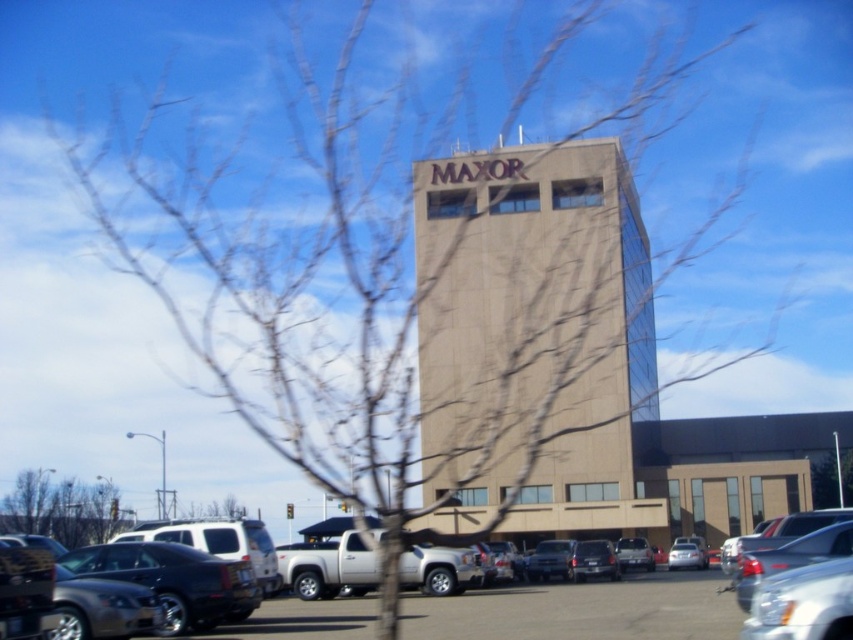
Question: Which point appears closest to the camera in this image?

Choices:
 (A) (107, 550)
 (B) (114, 524)
 (C) (814, 500)
 (D) (668, 566)

Answer: (A)

Question: In this image, where is beige concrete building at center located relative to matte black suv at center?

Choices:
 (A) left
 (B) right

Answer: (A)

Question: Can you confirm if beige concrete building at center is positioned to the right of satin black sedan at center?

Choices:
 (A) yes
 (B) no

Answer: (B)

Question: Can you confirm if beige concrete building at center is positioned below bare branches at center?

Choices:
 (A) no
 (B) yes

Answer: (A)

Question: Among these points, which one is nearest to the camera?

Choices:
 (A) (849, 481)
 (B) (637, 566)

Answer: (B)

Question: Which object is farther from the camera taking this photo?

Choices:
 (A) beige concrete building at center
 (B) satin silver sedan at lower center

Answer: (B)